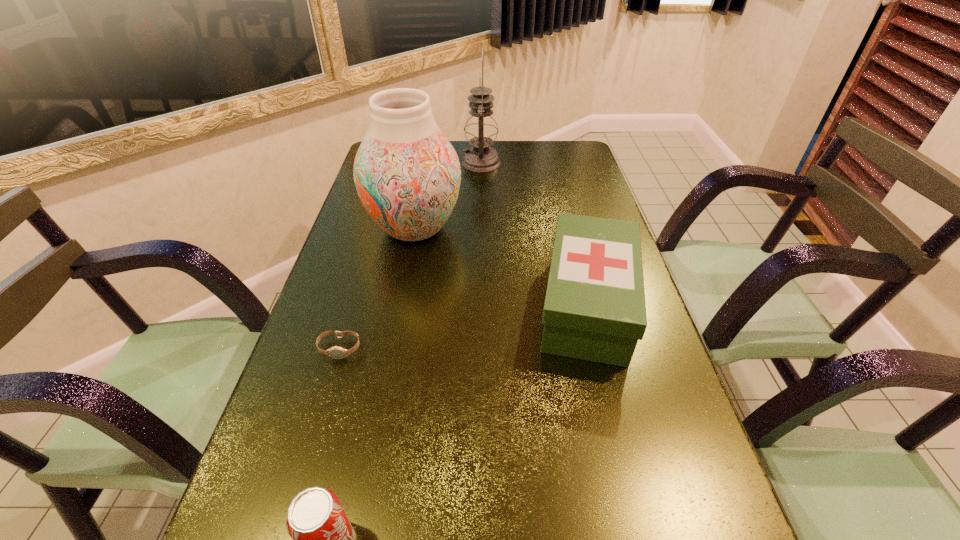
Where is `watch situated at the left edge`? watch situated at the left edge is located at coordinates (335, 352).

Find the location of a particular element. The height and width of the screenshot is (540, 960). object situated at the right edge is located at coordinates (594, 309).

Identify the location of vacant region at the far edge. Image resolution: width=960 pixels, height=540 pixels. (452, 145).

In the image, there is a desktop. At what (x,y) coordinates should I click in order to perform the action: click on vacant space at the left edge. Please return your answer as a coordinate pair (x, y). This screenshot has height=540, width=960. Looking at the image, I should click on (395, 265).

This screenshot has height=540, width=960. Identify the location of vacant space at the right edge of the desktop. (606, 213).

Where is `vacant point located between the shortest object and the vase`? vacant point located between the shortest object and the vase is located at coordinates (377, 288).

Find the location of a particular element. The image size is (960, 540). free space between the shortest object and the first-aid kit is located at coordinates (464, 327).

Identify the location of vacant space that is in between the farthest object and the rightmost object. Image resolution: width=960 pixels, height=540 pixels. (534, 234).

Where is `free spot between the shortest object and the rightmost object`? free spot between the shortest object and the rightmost object is located at coordinates (464, 327).

Locate an element on the screen. The height and width of the screenshot is (540, 960). vacant area that lies between the shortest object and the rightmost object is located at coordinates (464, 327).